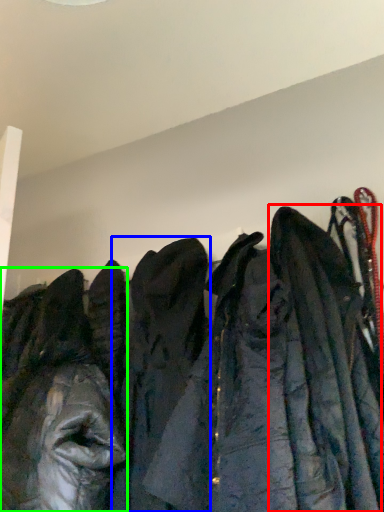
Question: Which is nearer to the cloak (highlighted by a red box)? cloak (highlighted by a blue box) or jacket (highlighted by a green box).

Choices:
 (A) cloak
 (B) jacket

Answer: (A)